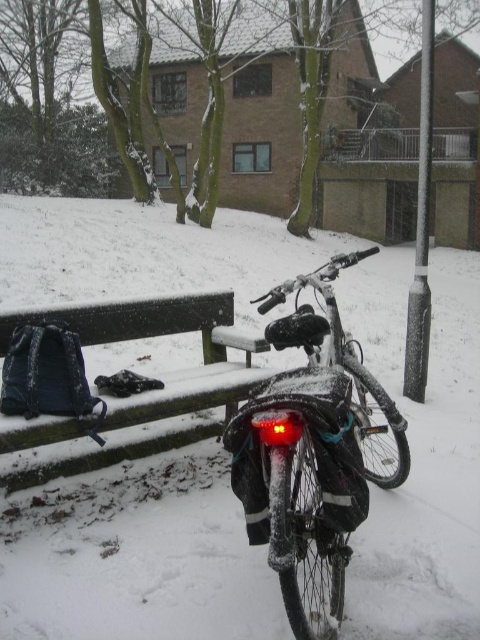
You are standing in the snowy area and want to sit on the dark blue fabric bench at lower left. Is the white matte snow at center in your way when you move towards the bench?

The white matte snow at center is located above the dark blue fabric bench at lower left, so it is not blocking the path to the bench. You can move towards the bench without any obstruction from the snow.

You are standing at the point marked by the coordinate point at (x=311, y=452). Looking around, you see a shiny metallic bicycle at center and a wooden bench with a blue backpack and black jacket to the left. Which object is closer to your current position?

The point at (x=311, y=452) is on the shiny metallic bicycle at center, so the bicycle is closer to your current position than the wooden bench with a blue backpack and black jacket to the left.

You are planning to move the dark blue fabric bench at lower left closer to the shiny metallic bicycle at center. Based on their sizes, will the bench take up more space than the bicycle after moving?

The shiny metallic bicycle at center is bigger than the dark blue fabric bench at lower left. Therefore, the bench will take up less space than the bicycle after moving.